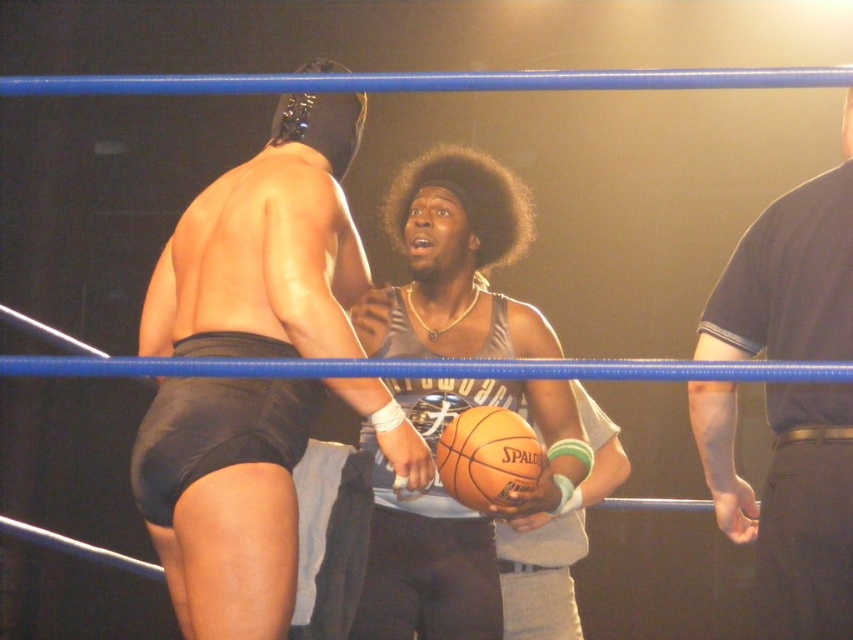
Is point (572, 492) less distant than point (445, 474)?

No, (572, 492) is further to viewer.

Is metallic silver basketball at center further to the viewer compared to orange leather basketball at center?

No.

Measure the distance between point (x=418, y=552) and camera.

7.95 feet

This screenshot has height=640, width=853. Find the location of `metallic silver basketball at center`. metallic silver basketball at center is located at coordinates (454, 264).

Can you confirm if metallic silver basketball at center is taller than dark gray t-shirt at right?

Yes.

Is point (567, 493) positioned behind point (727, 307)?

Yes, it is.

Which is in front, point (535, 348) or point (808, 330)?

Point (808, 330) is in front.

You are a GUI agent. You are given a task and a screenshot of the screen. Output one action in this format:
    pyautogui.click(x=<x>, y=<y>)
    Task: Click on the metallic silver basketball at center
    
    Given the screenshot: What is the action you would take?
    pyautogui.click(x=454, y=264)

Consider the image. Between shiny black shorts at center and metallic silver basketball at center, which one has more height?

With more height is metallic silver basketball at center.

Between point (180, 564) and point (454, 262), which one is positioned behind?

Positioned behind is point (454, 262).

Find the location of `shiny black shorts at center`. shiny black shorts at center is located at coordinates (267, 248).